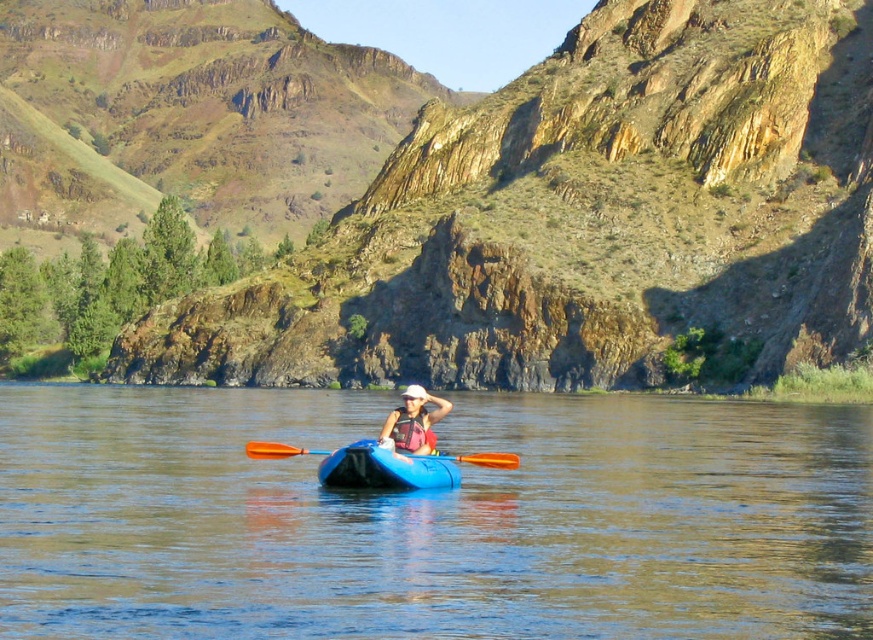
You are a photographer planning to take a photo of the blue plastic kayak at center and the orange wood paddle at center. If you want to ensure both objects are clearly visible in the frame, which object should you focus on first to account for their size difference?

The blue plastic kayak at center is bigger than the orange wood paddle at center, so you should focus on the blue plastic kayak at center first to ensure it is in sharp focus, as its larger size will require more attention to detail.

You are a photographer trying to capture both the blue plastic kayak at center and the blue plastic canoe at center in a single shot. Which one should you position closer to the left side of your camera frame to include both?

The blue plastic kayak at center is to the right of the blue plastic canoe at center, so you should position the blue plastic canoe at center closer to the left side of your camera frame to include both.

You are planning to bring both the blue plastic kayak at center and the blue plastic canoe at center onto a trailer that can only accommodate items up to 2 meters in width. Given that the kayak is wider than the canoe, will both items fit on the trailer if placed side by side?

The blue plastic kayak at center is wider than the blue plastic canoe at center. However, since the trailer can only accommodate items up to 2 meters in width, and we don not have the exact widths of each, we cannot determine if their combined width would exceed the limit. More information is needed.